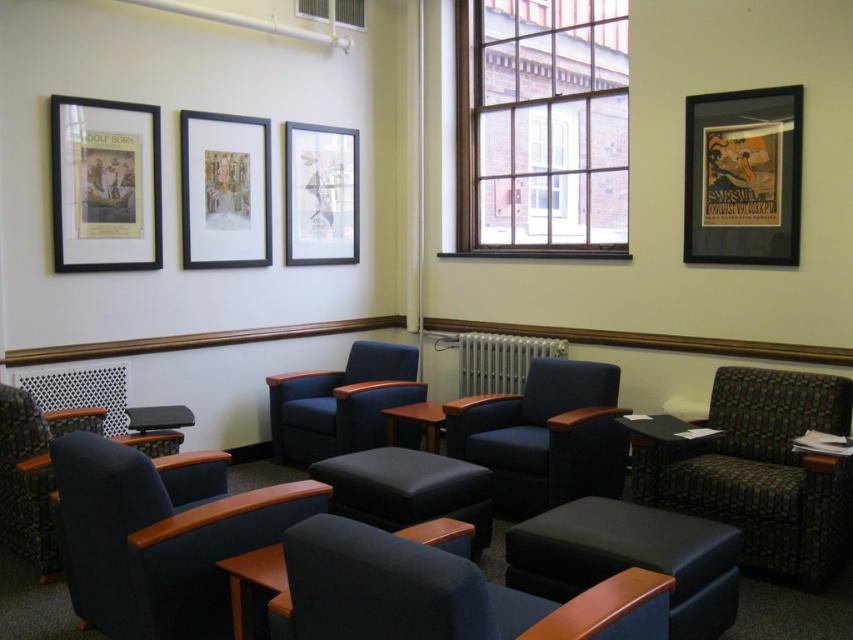
You are sitting in one of the dark blue armchairs and want to place a book on the nearest object. Which object should you choose between the black leather ottoman at center and the matte paper poster at upper left?

The black leather ottoman at center is closer to the viewer than the matte paper poster at upper left, so you should place the book on the black leather ottoman at center.

You are a person sitting in one of the dark blue armchairs and want to place a book on the nearest flat surface. Which object between the black leather ottoman at center and the matte paper poster at upper left can you use for placing the book?

The black leather ottoman at center is not as tall as the matte paper poster at upper left, so the ottoman is lower. Since the poster is on the wall, the only flat surface available for placing the book would be the black leather ottoman at center.

From the picture: You are a guest in the waiting area and want to sit as far away as possible from the white metallic radiator at center. Which direction should you move relative to the matte blue chair at center?

The matte blue chair at center is positioned on the left side of the white metallic radiator at center. To sit as far away as possible from the radiator, you should move to the right side of the matte blue chair at center.